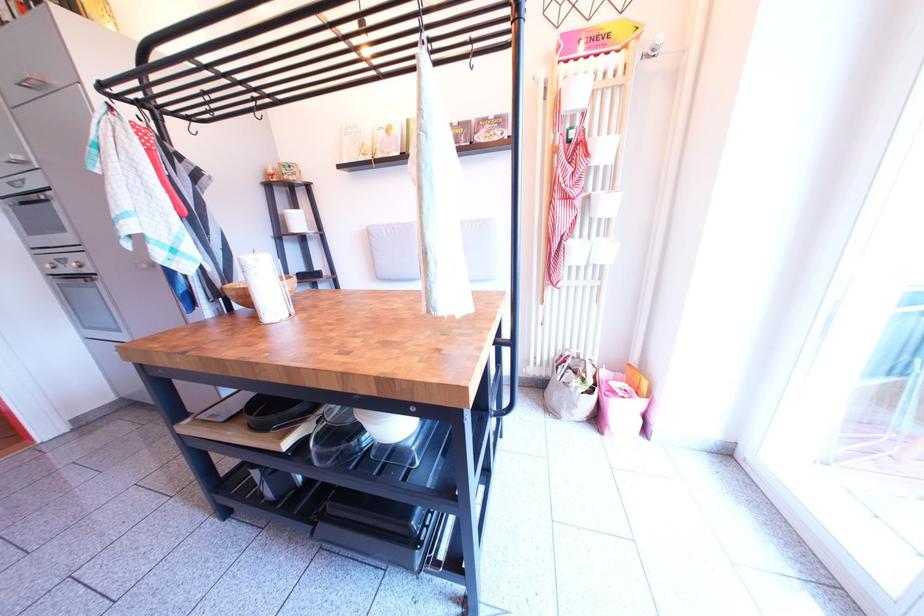
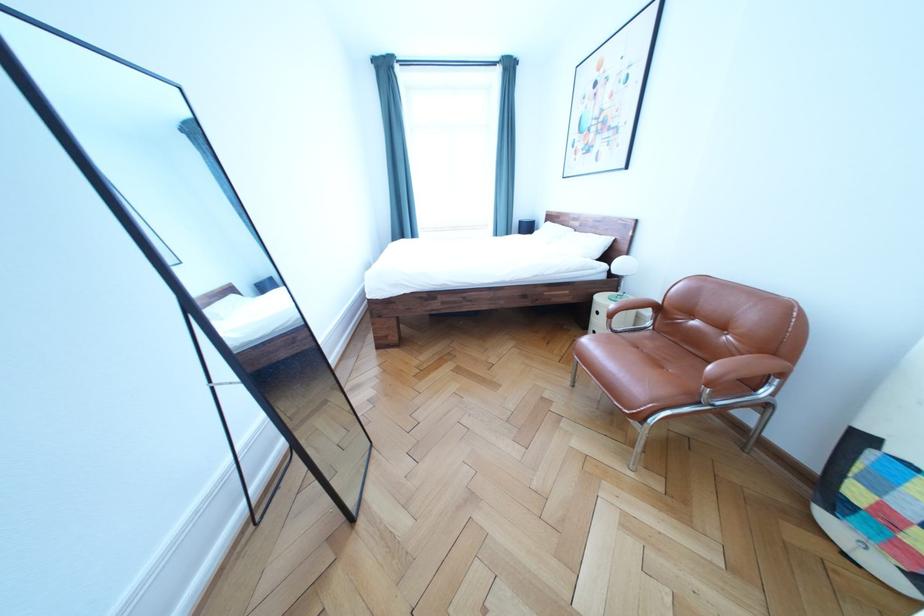
Question: I am providing you with two images of the same scene from different viewpoints. Please identify which objects are invisible in image2.

Choices:
 (A) chair armrest
 (B) nightstand drawer handle
 (C) white plate
 (D) stuffed animal pillow

Answer: (C)